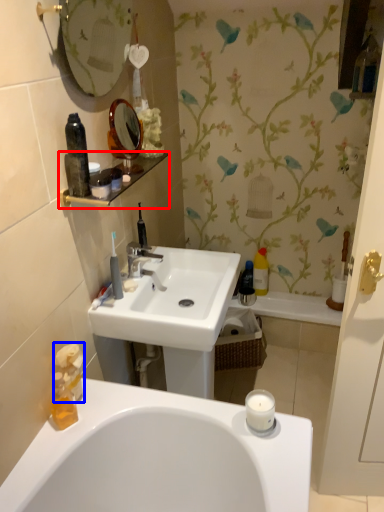
Question: Among these objects, which one is nearest to the camera, balustrade (highlighted by a red box) or toiletry (highlighted by a blue box)?

Choices:
 (A) balustrade
 (B) toiletry

Answer: (A)